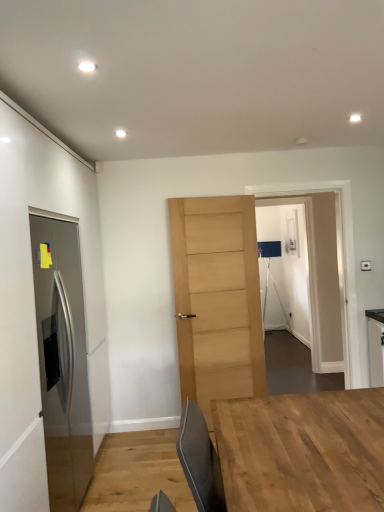
Question: Which direction should I rotate to look at transparent glass door at center, marked as the 1th glass door in a back-to-front arrangement, — up or down?

Choices:
 (A) down
 (B) up

Answer: (A)

Question: Would you say transparent glass door at center, marked as the 1th glass door in a back-to-front arrangement, is a long distance from light wood door at center, which is counted as the 2th door, starting from the left?

Choices:
 (A) yes
 (B) no

Answer: (A)

Question: Is transparent glass door at center, marked as the 1th glass door in a back-to-front arrangement, positioned in front of light wood door at center, the 2th door when ordered from front to back?

Choices:
 (A) yes
 (B) no

Answer: (B)

Question: Is transparent glass door at center, marked as the 1th glass door in a back-to-front arrangement, aimed at light wood door at center, the 2th door when ordered from front to back?

Choices:
 (A) no
 (B) yes

Answer: (A)

Question: Is transparent glass door at center, marked as the 1th glass door in a back-to-front arrangement, bigger than light wood door at center, marked as the 1th door in a right-to-left arrangement?

Choices:
 (A) no
 (B) yes

Answer: (A)

Question: Considering the relative positions of transparent glass door at center, marked as the 1th glass door in a back-to-front arrangement, and light wood door at center, which is counted as the 2th door, starting from the left, in the image provided, is transparent glass door at center, marked as the 1th glass door in a back-to-front arrangement, to the right of light wood door at center, which is counted as the 2th door, starting from the left, from the viewer's perspective?

Choices:
 (A) yes
 (B) no

Answer: (A)

Question: From a real-world perspective, does transparent glass door at center, marked as the 1th glass door in a back-to-front arrangement, sit lower than light wood door at center, the 2th door when ordered from front to back?

Choices:
 (A) no
 (B) yes

Answer: (B)

Question: Is light wood door at center, marked as the 1th door in a right-to-left arrangement, surrounded by transparent glass door at center, acting as the 1th glass door starting from the front?

Choices:
 (A) no
 (B) yes

Answer: (A)

Question: From the image's perspective, is transparent glass door at center, acting as the 1th glass door starting from the front, over light wood door at center, the 2th door when ordered from front to back?

Choices:
 (A) no
 (B) yes

Answer: (B)

Question: From the image's perspective, is transparent glass door at center, acting as the 1th glass door starting from the front, located beneath light wood door at center, which is the 1th door from back to front?

Choices:
 (A) yes
 (B) no

Answer: (B)

Question: Is transparent glass door at center, acting as the 1th glass door starting from the front, positioned with its back to light wood door at center, the 2th door when ordered from front to back?

Choices:
 (A) yes
 (B) no

Answer: (B)

Question: Does transparent glass door at center, marked as the second glass door in a back-to-front arrangement, appear on the left side of light wood door at center, which is the 1th door from back to front?

Choices:
 (A) no
 (B) yes

Answer: (A)

Question: From a real-world perspective, is transparent glass door at center, marked as the second glass door in a back-to-front arrangement, located beneath light wood door at center, the 2th door when ordered from front to back?

Choices:
 (A) no
 (B) yes

Answer: (A)

Question: From a real-world perspective, is natural wood table at center located beneath transparent glass door at center, marked as the second glass door in a back-to-front arrangement?

Choices:
 (A) yes
 (B) no

Answer: (A)